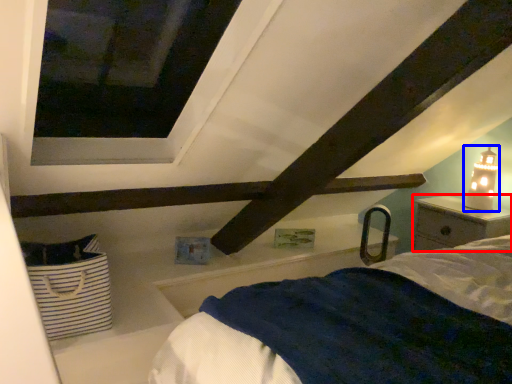
Question: Which point is further to the camera, nightstand (highlighted by a red box) or table lamp (highlighted by a blue box)?

Choices:
 (A) nightstand
 (B) table lamp

Answer: (B)